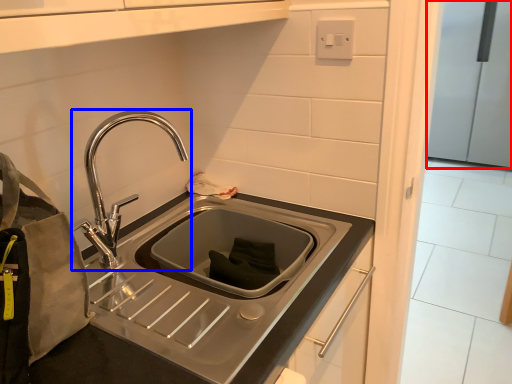
Question: Among these objects, which one is farthest to the camera, appliance (highlighted by a red box) or tap (highlighted by a blue box)?

Choices:
 (A) appliance
 (B) tap

Answer: (A)